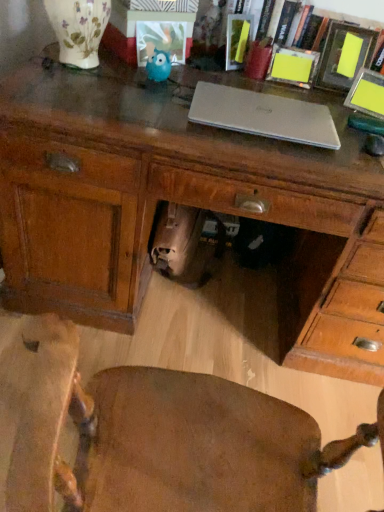
Question: From the image's perspective, would you say blue fuzzy owl at center is shown under wooden chair at center?

Choices:
 (A) no
 (B) yes

Answer: (A)

Question: Considering the relative sizes of blue fuzzy owl at center and wooden chair at center in the image provided, is blue fuzzy owl at center taller than wooden chair at center?

Choices:
 (A) yes
 (B) no

Answer: (B)

Question: From a real-world perspective, is blue fuzzy owl at center physically above wooden chair at center?

Choices:
 (A) yes
 (B) no

Answer: (A)

Question: Considering the relative sizes of blue fuzzy owl at center and wooden chair at center in the image provided, is blue fuzzy owl at center bigger than wooden chair at center?

Choices:
 (A) no
 (B) yes

Answer: (A)

Question: Can you confirm if blue fuzzy owl at center is smaller than wooden chair at center?

Choices:
 (A) yes
 (B) no

Answer: (A)

Question: Is silver metallic laptop at center taller or shorter than wooden desk at center?

Choices:
 (A) short
 (B) tall

Answer: (A)

Question: Considering the positions of silver metallic laptop at center and wooden desk at center in the image, is silver metallic laptop at center wider or thinner than wooden desk at center?

Choices:
 (A) wide
 (B) thin

Answer: (B)

Question: Do you think silver metallic laptop at center is within wooden desk at center, or outside of it?

Choices:
 (A) inside
 (B) outside

Answer: (B)

Question: Is silver metallic laptop at center to the left or to the right of wooden desk at center in the image?

Choices:
 (A) right
 (B) left

Answer: (A)

Question: From the image's perspective, is silver metallic laptop at center above or below matte plastic picture frame at center, marked as the fourth picture frame in a right-to-left arrangement?

Choices:
 (A) below
 (B) above

Answer: (A)

Question: In terms of size, does silver metallic laptop at center appear bigger or smaller than matte plastic picture frame at center, the first picture frame positioned from the left?

Choices:
 (A) small
 (B) big

Answer: (B)

Question: Is silver metallic laptop at center in front of or behind matte plastic picture frame at center, marked as the fourth picture frame in a right-to-left arrangement, in the image?

Choices:
 (A) front
 (B) behind

Answer: (A)

Question: In terms of width, does silver metallic laptop at center look wider or thinner when compared to matte plastic picture frame at center, marked as the fourth picture frame in a right-to-left arrangement?

Choices:
 (A) wide
 (B) thin

Answer: (A)

Question: Based on their sizes in the image, would you say wooden desk at center is bigger or smaller than yellow paper picture frame at upper right, which ranks as the 1th picture frame in right-to-left order?

Choices:
 (A) small
 (B) big

Answer: (B)

Question: From their relative heights in the image, would you say wooden desk at center is taller or shorter than yellow paper picture frame at upper right, which ranks as the 4th picture frame in left-to-right order?

Choices:
 (A) short
 (B) tall

Answer: (B)